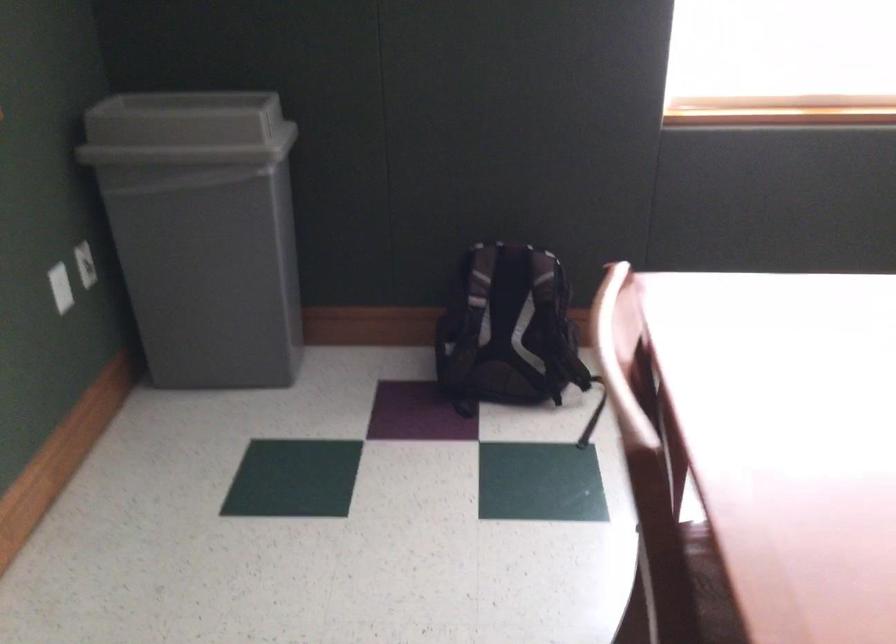
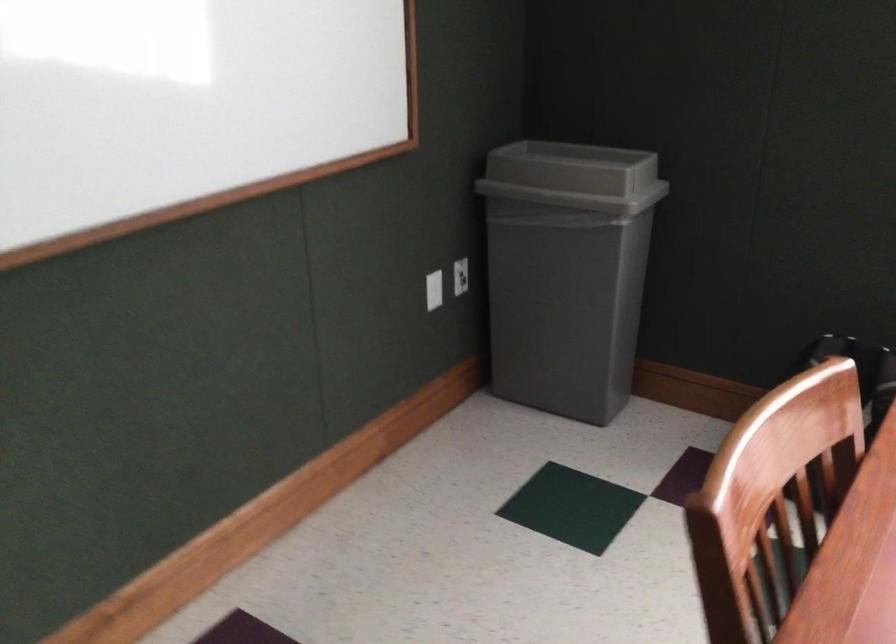
Question: The first image is from the beginning of the video and the second image is from the end. How did the camera likely rotate when shooting the video?

Choices:
 (A) Left
 (B) Right
 (C) Up
 (D) Down

Answer: (A)